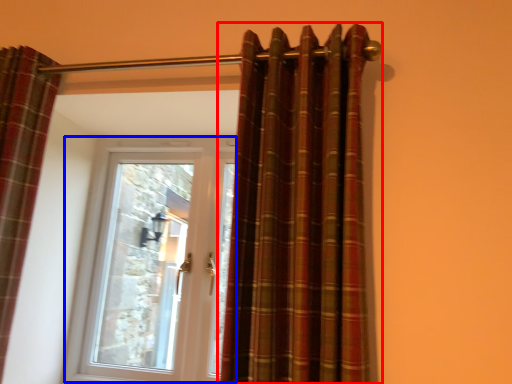
Question: Which of the following is the farthest to the observer, curtain (highlighted by a red box) or door (highlighted by a blue box)?

Choices:
 (A) curtain
 (B) door

Answer: (B)